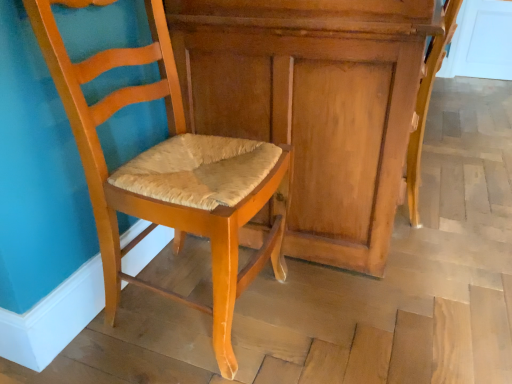
Question: Looking at the image, does light brown wood chair at lower right, arranged as the first chair when viewed from the right, seem bigger or smaller compared to matte wood chair at center, placed as the 1th chair when sorted from left to right?

Choices:
 (A) small
 (B) big

Answer: (A)

Question: From their relative heights in the image, would you say light brown wood chair at lower right, which is the second chair in left-to-right order, is taller or shorter than matte wood chair at center, placed as the 1th chair when sorted from left to right?

Choices:
 (A) short
 (B) tall

Answer: (A)

Question: Which of these objects is positioned closest to the wooden dresser at center?

Choices:
 (A) light brown wood chair at lower right, which is the second chair in left-to-right order
 (B) matte wood chair at center, placed as the 1th chair when sorted from left to right

Answer: (B)

Question: Estimate the real-world distances between objects in this image. Which object is closer to the light brown wood chair at lower right, arranged as the first chair when viewed from the right?

Choices:
 (A) wooden dresser at center
 (B) matte wood chair at center, the second chair viewed from the right

Answer: (A)